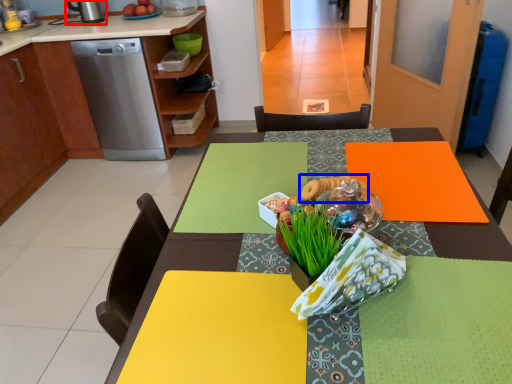
Question: Which object is closer to the camera taking this photo, kitchen appliance (highlighted by a red box) or food (highlighted by a blue box)?

Choices:
 (A) kitchen appliance
 (B) food

Answer: (B)